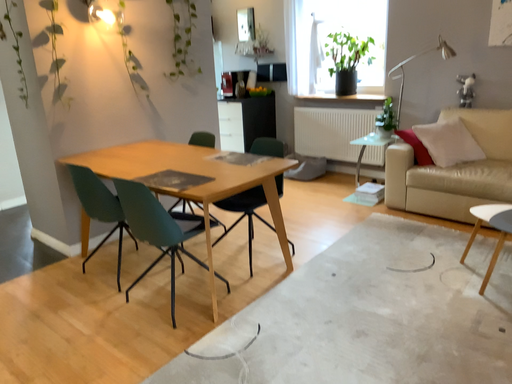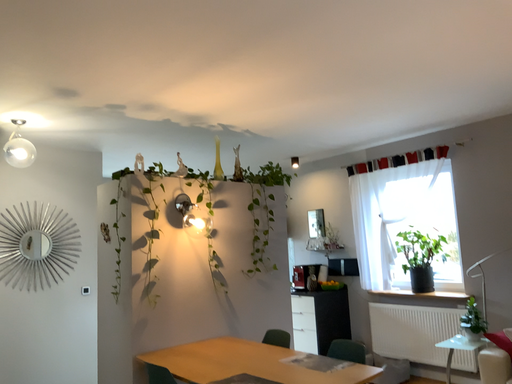
Question: Which way did the camera rotate in the video?

Choices:
 (A) rotated upward
 (B) rotated downward

Answer: (A)